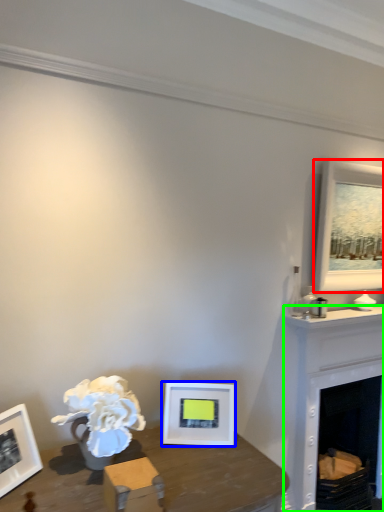
Question: Estimate the real-world distances between objects in this image. Which object is farther from picture frame (highlighted by a red box), picture frame (highlighted by a blue box) or fireplace (highlighted by a green box)?

Choices:
 (A) picture frame
 (B) fireplace

Answer: (A)